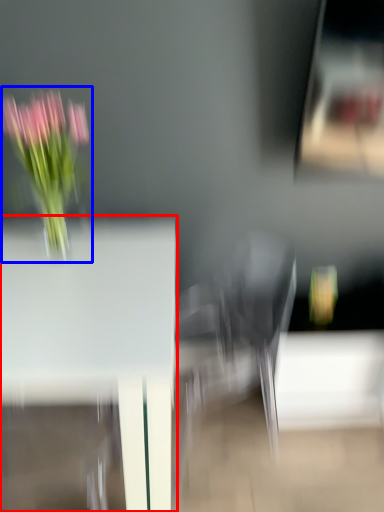
Question: Which point is closer to the camera, table (highlighted by a red box) or floral arrangement (highlighted by a blue box)?

Choices:
 (A) table
 (B) floral arrangement

Answer: (A)